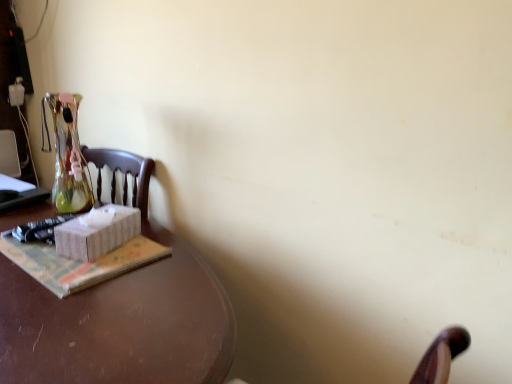
What are the coordinates of `vacant area that is in front of white wicker box at left` in the screenshot? It's located at (81, 283).